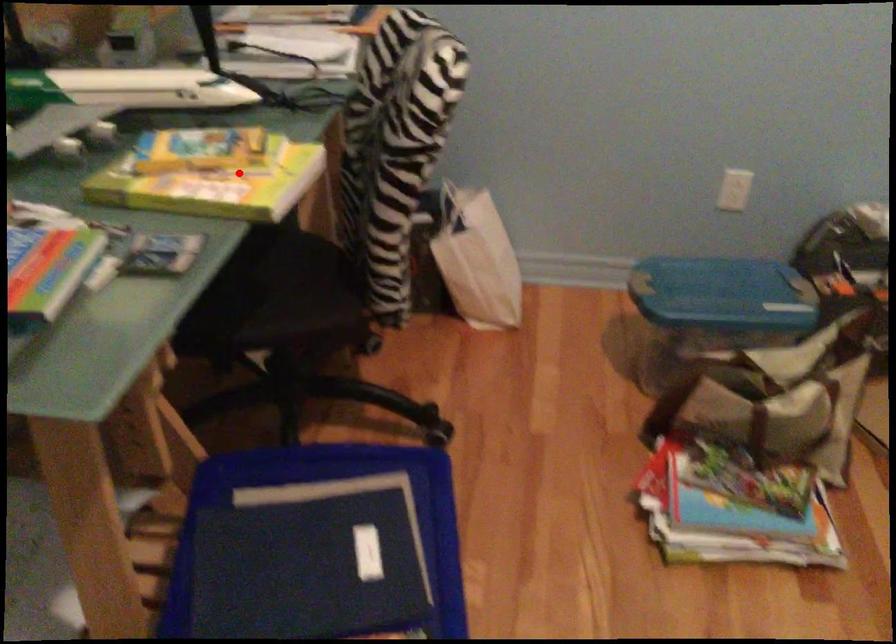
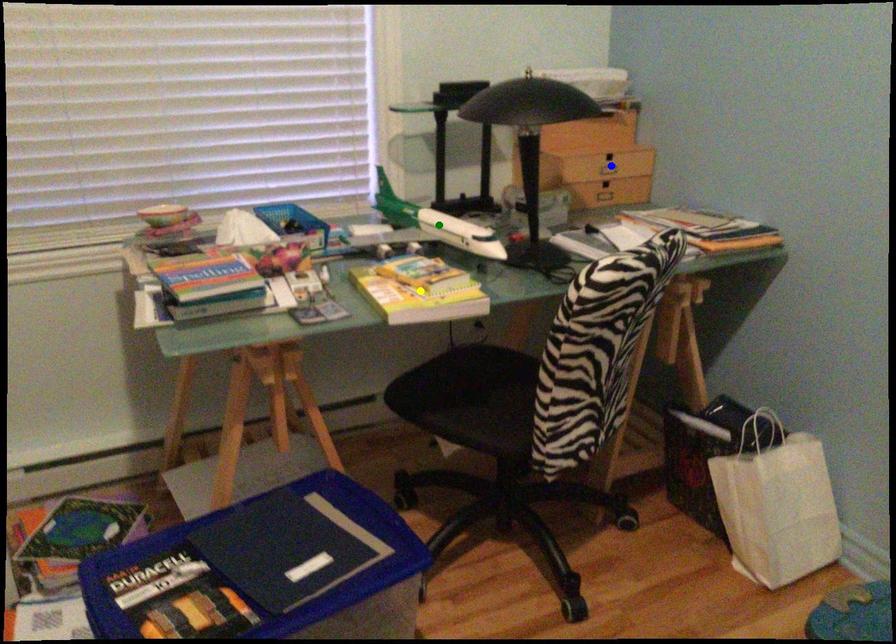
Question: I am providing you with two images of the same scene from different viewpoints. A red point is marked on the first image. You are given multiple points on the second image. Which mark in image 2 goes with the point in image 1?

Choices:
 (A) blue point
 (B) green point
 (C) yellow point

Answer: (C)